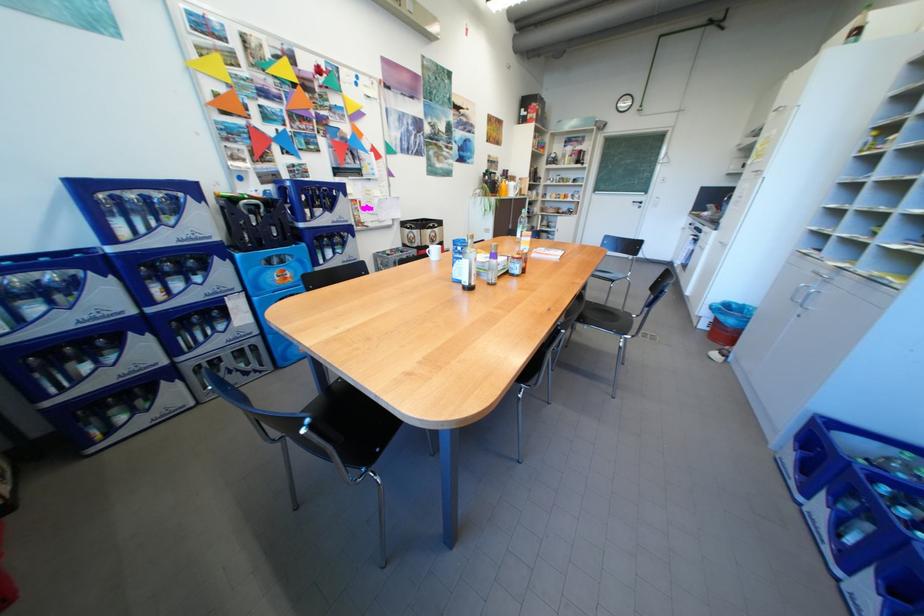
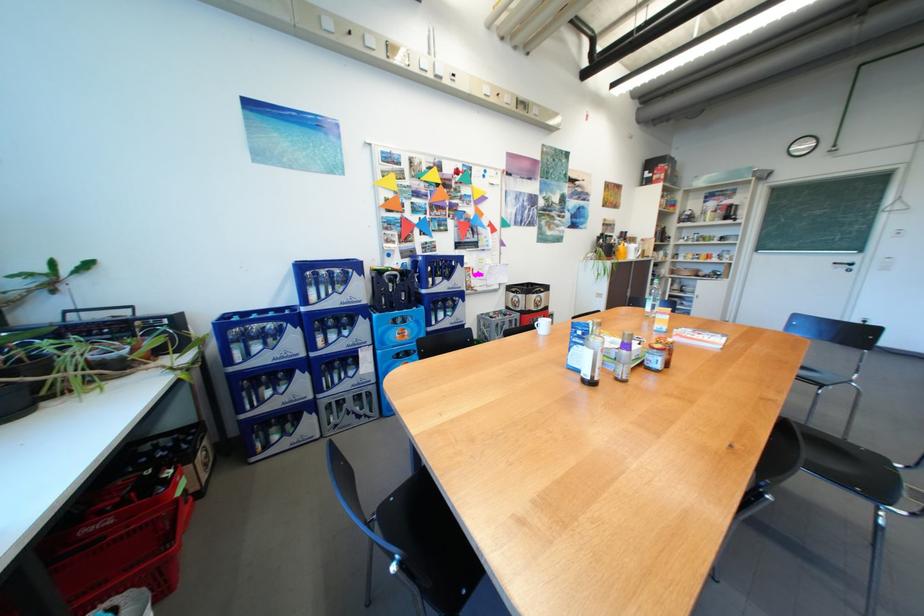
What movement of the cameraman would produce the second image?

The movement direction of the cameraman is left, forward.